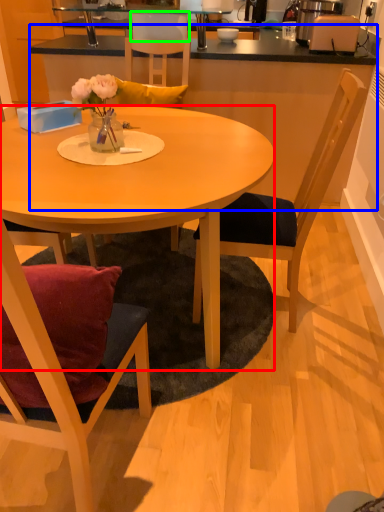
Question: Considering the real-world distances, which object is closest to desk (highlighted by a red box)? counter top (highlighted by a blue box) or armchair (highlighted by a green box).

Choices:
 (A) counter top
 (B) armchair

Answer: (A)